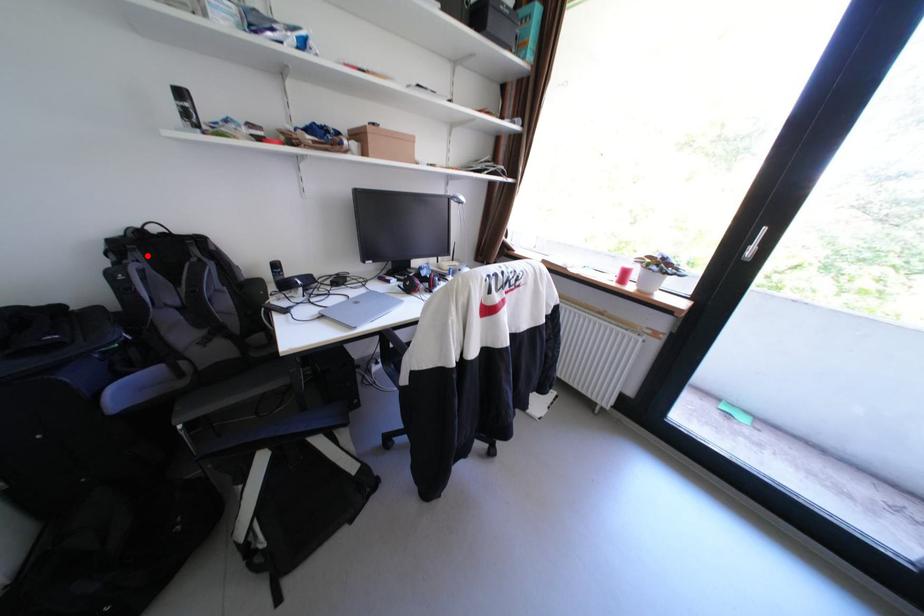
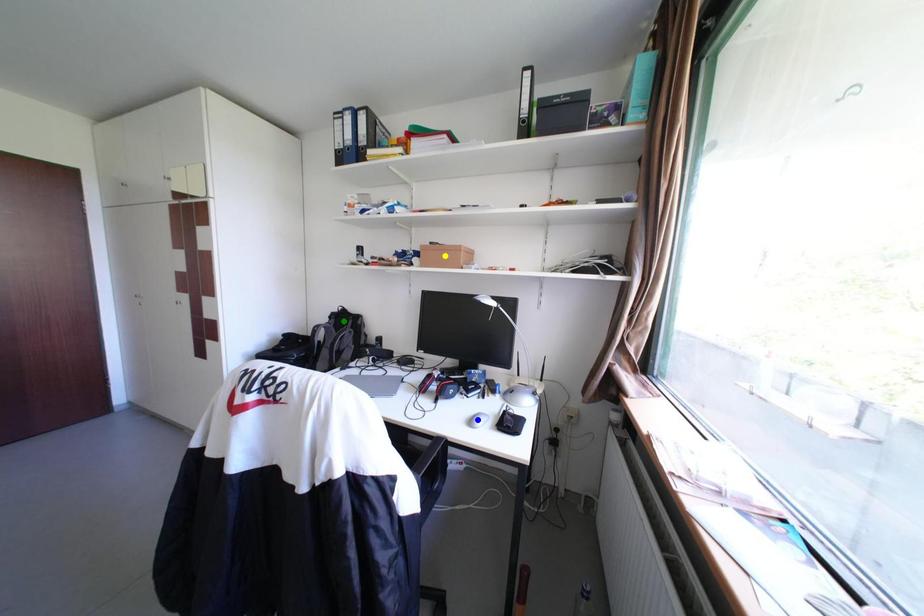
Question: I am providing you with two images of the same scene from different viewpoints. A red point is marked on the first image. You are given multiple points on the second image. Which spot in image 2 lines up with the point in image 1?

Choices:
 (A) blue point
 (B) green point
 (C) yellow point

Answer: (B)